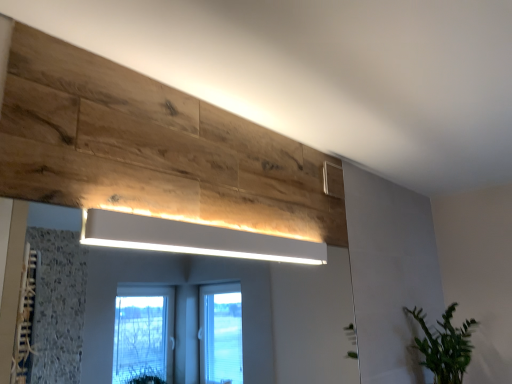
Describe the element at coordinates (193, 239) in the screenshot. The height and width of the screenshot is (384, 512). I see `white matte rectangular light fixture at upper center` at that location.

Where is `white matte rectangular light fixture at upper center`? The height and width of the screenshot is (384, 512). white matte rectangular light fixture at upper center is located at coordinates (193, 239).

I want to click on green leafy plant at lower right, so click(444, 346).

What is the approximate height of green leafy plant at lower right?

green leafy plant at lower right is 18.57 inches tall.

This screenshot has width=512, height=384. Describe the element at coordinates (444, 346) in the screenshot. I see `green leafy plant at lower right` at that location.

This screenshot has width=512, height=384. In order to click on white matte rectangular light fixture at upper center in this screenshot , I will do `click(193, 239)`.

Is white matte rectangular light fixture at upper center at the right side of green leafy plant at lower right?

No.

Which object is closer to the camera taking this photo, white matte rectangular light fixture at upper center or green leafy plant at lower right?

white matte rectangular light fixture at upper center is in front.

Is point (125, 235) more distant than point (456, 347)?

No, it is not.

From the image's perspective, which is above, white matte rectangular light fixture at upper center or green leafy plant at lower right?

white matte rectangular light fixture at upper center, from the image's perspective.

Based on the photo, from a real-world perspective, who is located higher, white matte rectangular light fixture at upper center or green leafy plant at lower right?

white matte rectangular light fixture at upper center is physically above.

Considering the sizes of objects white matte rectangular light fixture at upper center and green leafy plant at lower right in the image provided, who is thinner, white matte rectangular light fixture at upper center or green leafy plant at lower right?

With smaller width is white matte rectangular light fixture at upper center.

Consider the image. Does white matte rectangular light fixture at upper center have a greater height compared to green leafy plant at lower right?

No.

Considering the sizes of objects white matte rectangular light fixture at upper center and green leafy plant at lower right in the image provided, who is smaller, white matte rectangular light fixture at upper center or green leafy plant at lower right?

white matte rectangular light fixture at upper center is smaller.

Is white matte rectangular light fixture at upper center positioned beyond the bounds of green leafy plant at lower right?

Absolutely, white matte rectangular light fixture at upper center is external to green leafy plant at lower right.

Is white matte rectangular light fixture at upper center next to green leafy plant at lower right and touching it?

No, white matte rectangular light fixture at upper center is not touching green leafy plant at lower right.

Is white matte rectangular light fixture at upper center looking in the opposite direction of green leafy plant at lower right?

No, white matte rectangular light fixture at upper center is not facing the opposite direction of green leafy plant at lower right.

Find the location of a particular element. houseplant that appears below the white matte rectangular light fixture at upper center (from a real-world perspective) is located at coordinates (444, 346).

In the image, is green leafy plant at lower right on the left side or the right side of white matte rectangular light fixture at upper center?

green leafy plant at lower right is positioned on white matte rectangular light fixture at upper center's right side.

Is green leafy plant at lower right further to camera compared to white matte rectangular light fixture at upper center?

Yes.

Is point (469, 361) farther from viewer compared to point (212, 253)?

Yes, it is.

From the image's perspective, is green leafy plant at lower right located above or below white matte rectangular light fixture at upper center?

green leafy plant at lower right is situated lower than white matte rectangular light fixture at upper center in the image.

From a real-world perspective, which is physically below, green leafy plant at lower right or white matte rectangular light fixture at upper center?

green leafy plant at lower right is physically lower.

In terms of width, does green leafy plant at lower right look wider or thinner when compared to white matte rectangular light fixture at upper center?

green leafy plant at lower right is wider than white matte rectangular light fixture at upper center.

Considering the relative sizes of green leafy plant at lower right and white matte rectangular light fixture at upper center in the image provided, is green leafy plant at lower right shorter than white matte rectangular light fixture at upper center?

Incorrect, the height of green leafy plant at lower right does not fall short of that of white matte rectangular light fixture at upper center.

Who is smaller, green leafy plant at lower right or white matte rectangular light fixture at upper center?

white matte rectangular light fixture at upper center.

Is white matte rectangular light fixture at upper center surrounded by green leafy plant at lower right?

No, white matte rectangular light fixture at upper center is located outside of green leafy plant at lower right.

Are green leafy plant at lower right and white matte rectangular light fixture at upper center located far from each other?

Yes.

In the scene shown: Does green leafy plant at lower right turn towards white matte rectangular light fixture at upper center?

No, green leafy plant at lower right does not turn towards white matte rectangular light fixture at upper center.

How different are the orientations of green leafy plant at lower right and white matte rectangular light fixture at upper center in degrees?

The angular difference between green leafy plant at lower right and white matte rectangular light fixture at upper center is 0.649 degrees.

You are a GUI agent. You are given a task and a screenshot of the screen. Output one action in this format:
    pyautogui.click(x=<x>, y=<y>)
    Task: Click on the light fixture in front of the green leafy plant at lower right
    
    Given the screenshot: What is the action you would take?
    pyautogui.click(x=193, y=239)

Where is `light fixture to the left of green leafy plant at lower right`? light fixture to the left of green leafy plant at lower right is located at coordinates (193, 239).

This screenshot has height=384, width=512. In order to click on houseplant that is under the white matte rectangular light fixture at upper center (from a real-world perspective) in this screenshot , I will do `click(444, 346)`.